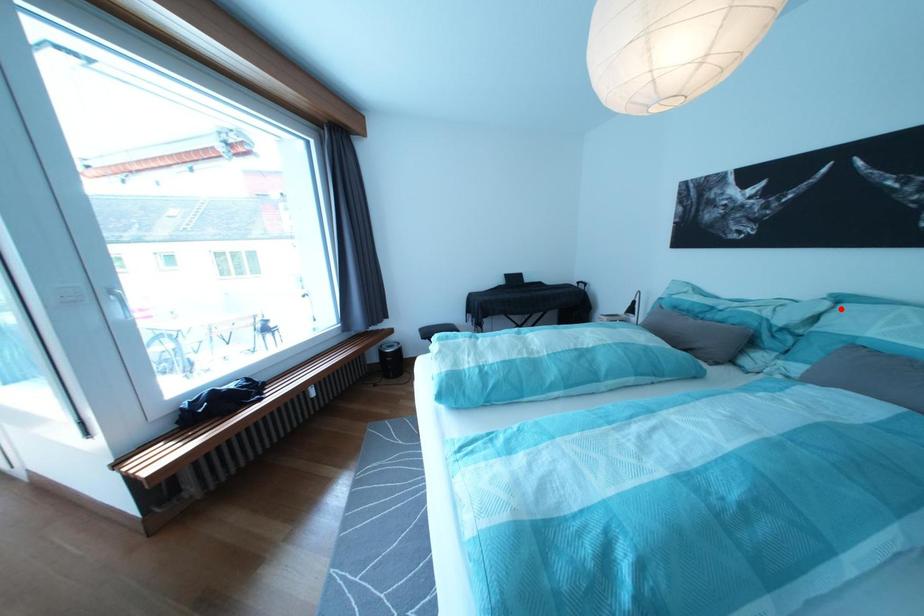
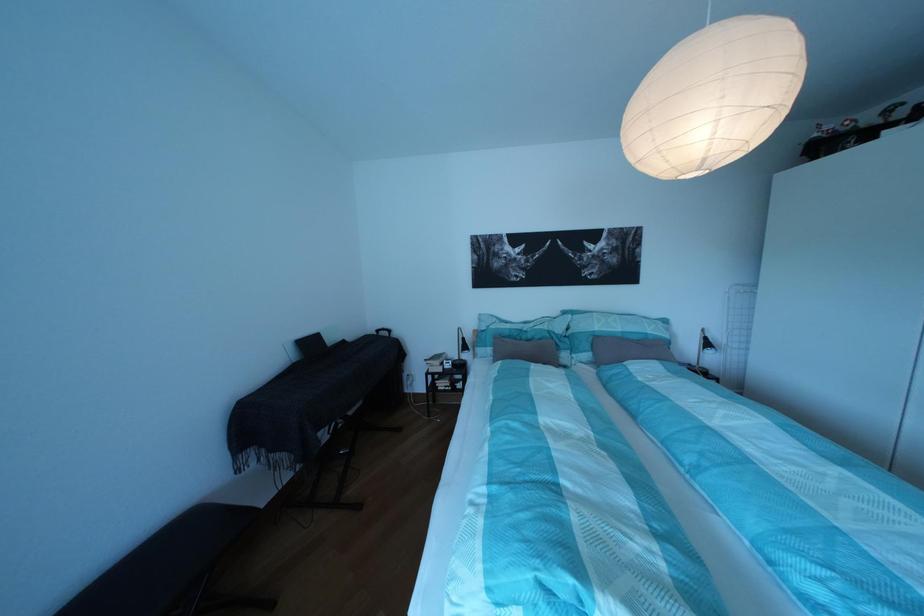
Find the pixel in the second image that matches the highlighted location in the first image.

(582, 322)